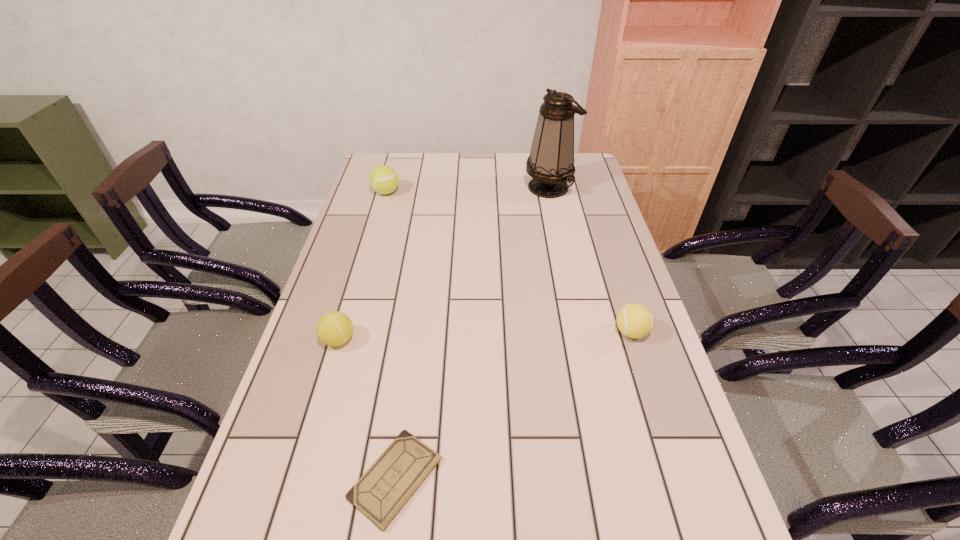
At what (x,y) coordinates should I click in order to perform the action: click on the tallest object. Please return your answer as a coordinate pair (x, y). Looking at the image, I should click on (551, 161).

Identify the location of the farthest tennis ball. This screenshot has height=540, width=960. (383, 179).

This screenshot has width=960, height=540. Find the location of `the rightmost tennis ball`. the rightmost tennis ball is located at coordinates (634, 320).

Locate an element on the screen. the shortest object is located at coordinates (380, 494).

Find the location of `the third object from left to right`. the third object from left to right is located at coordinates (380, 494).

Identify the location of vacant space situated 0.070m on the back of the tallest object. (544, 165).

Locate an element on the screen. The height and width of the screenshot is (540, 960). vacant area situated on the right of the farthest tennis ball is located at coordinates (499, 192).

I want to click on free space located 0.250m on the front of the rightmost tennis ball, so click(x=666, y=443).

I want to click on vacant space located on the right of the third object from right to left, so click(648, 478).

Locate an element on the screen. This screenshot has width=960, height=540. object that is at the far edge is located at coordinates (551, 161).